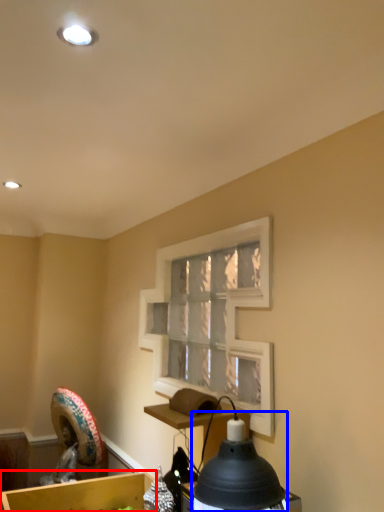
Question: Among these objects, which one is nearest to the camera, cardboard box (highlighted by a red box) or lamp (highlighted by a blue box)?

Choices:
 (A) cardboard box
 (B) lamp

Answer: (B)